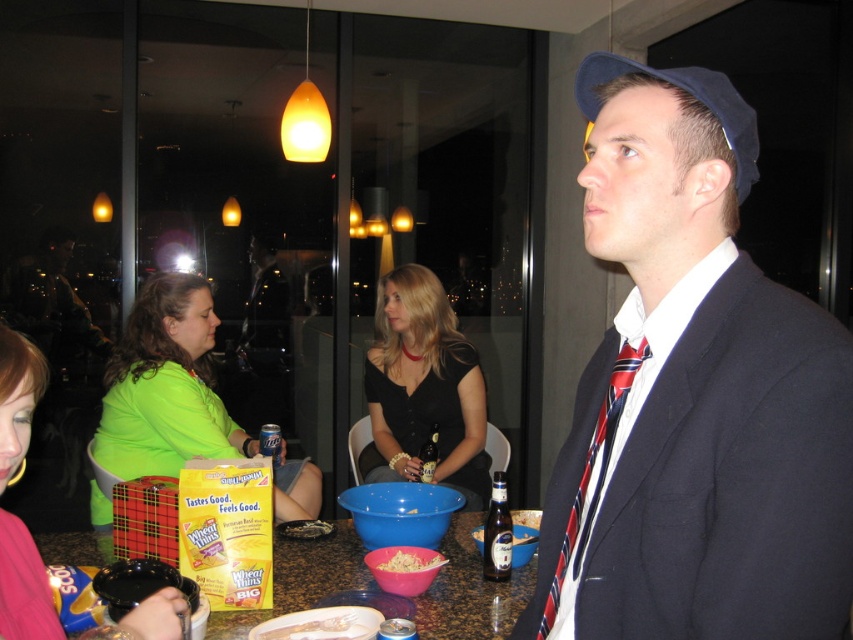
Question: Does green matte shirt at upper left have a larger size compared to brown glass beer bottle at center?

Choices:
 (A) yes
 (B) no

Answer: (A)

Question: Estimate the real-world distances between objects in this image. Which object is closer to the shiny plastic bowl at center?

Choices:
 (A) green matte shirt at upper left
 (B) navy blue fabric suit at upper right

Answer: (A)

Question: Is navy blue fabric suit at upper right bigger than shiny plastic bowl at center?

Choices:
 (A) yes
 (B) no

Answer: (A)

Question: Which object is farther from the camera taking this photo?

Choices:
 (A) shiny plastic bowl at center
 (B) black matte shirt at center

Answer: (B)

Question: Which point is farther to the camera?

Choices:
 (A) navy blue fabric suit at upper right
 (B) white creamy pasta at center
 (C) shiny plastic bowl at center
 (D) red/white/blue striped tie at right

Answer: (C)

Question: From the image, what is the correct spatial relationship of black matte shirt at center in relation to blue fabric hat at upper right?

Choices:
 (A) above
 (B) below

Answer: (B)